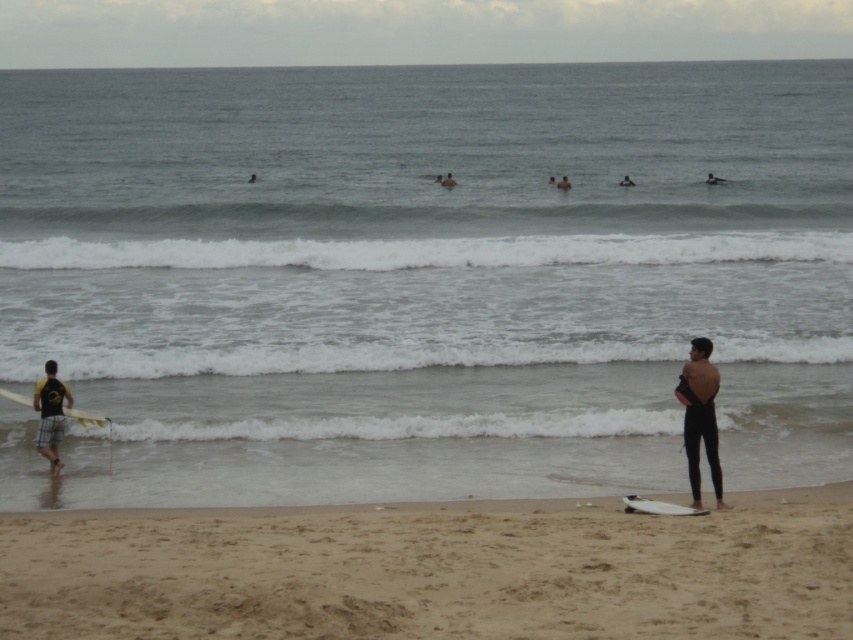
Is black matte wetsuit at right to the left of white matte surfboard at left from the viewer's perspective?

In fact, black matte wetsuit at right is to the right of white matte surfboard at left.

Who is lower down, black matte wetsuit at right or white matte surfboard at left?

black matte wetsuit at right

Is point (704, 356) behind point (15, 396)?

No, it is not.

At what (x,y) coordinates should I click in order to perform the action: click on black matte wetsuit at right. Please return your answer as a coordinate pair (x, y). Looking at the image, I should click on (701, 419).

Who is more forward, (839, 620) or (657, 509)?

Point (839, 620) is in front.

Locate an element on the screen. The height and width of the screenshot is (640, 853). fine-grained sand at lower center is located at coordinates (434, 570).

Between clear water at surfboard right and smooth black wetsuit at center, which one has more height?

Standing taller between the two is clear water at surfboard right.

Which is behind, point (305, 161) or point (625, 177)?

The point (305, 161) is more distant.

Where is `clear water at surfboard right`? The image size is (853, 640). clear water at surfboard right is located at coordinates (428, 275).